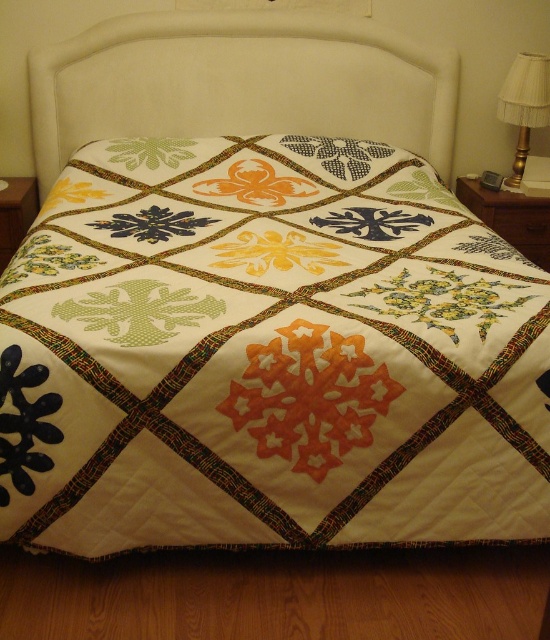
You are arranging flowers in the room and want to place a vase between the white fabric headboard at upper center and the gold metallic lampshade at right. Based on their positions, where should the vase be placed?

The white fabric headboard at upper center is above the gold metallic lampshade at right, so the vase should be placed between them in a vertical position, below the headboard and above the lampshade.

You are standing at the center of the bed. Which direction should you move to reach the black fabric flower at lower left?

The black fabric flower at lower left is located at coordinates approximately 0.658 along the x and 0.045 along the y. Since you are at the center, moving towards the lower left direction will get you to the black fabric flower at lower left.